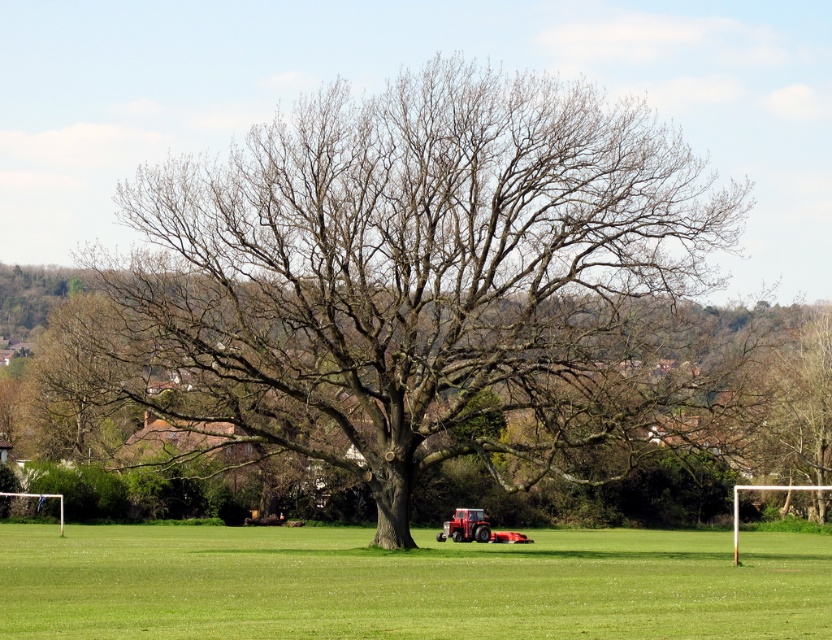
Question: Does bare branches at center have a larger size compared to green grass at center?

Choices:
 (A) yes
 (B) no

Answer: (B)

Question: In this image, where is bare branches at center located relative to green grass at center?

Choices:
 (A) above
 (B) below

Answer: (A)

Question: Considering the relative positions of bare branches at center and green grass at center in the image provided, where is bare branches at center located with respect to green grass at center?

Choices:
 (A) below
 (B) above

Answer: (B)

Question: Among these points, which one is nearest to the camera?

Choices:
 (A) (323, 358)
 (B) (791, 541)

Answer: (A)